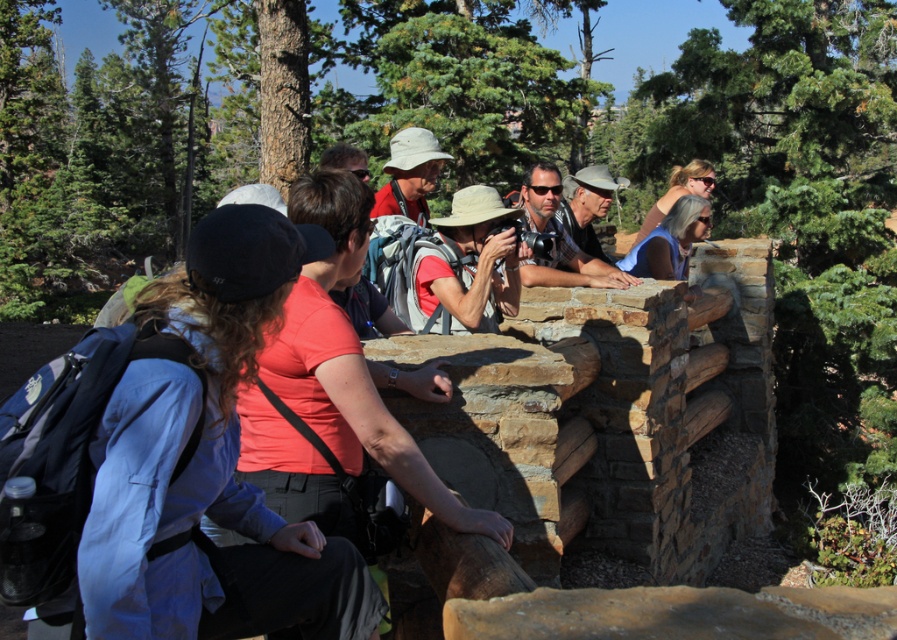
Is matte red shirt at center bigger than blonde hair at upper right?

Actually, matte red shirt at center might be smaller than blonde hair at upper right.

Measure the distance between matte red shirt at center and camera.

They are 3.86 meters apart.

Describe the element at coordinates (473, 262) in the screenshot. This screenshot has width=897, height=640. I see `matte red shirt at center` at that location.

The width and height of the screenshot is (897, 640). What are the coordinates of `matte red shirt at center` in the screenshot? It's located at pos(473,262).

From the picture: Is matte white hat at center wider than blonde hair at upper right?

In fact, matte white hat at center might be narrower than blonde hair at upper right.

Which of these two, matte white hat at center or blonde hair at upper right, stands shorter?

matte white hat at center

Which is behind, point (432, 147) or point (673, 188)?

The point (673, 188) is more distant.

Locate an element on the screen. matte white hat at center is located at coordinates (410, 173).

Is matte white hat at center positioned before matte blue shirt at upper right?

That is True.

Is point (427, 134) positioned before point (666, 257)?

Yes.

At what (x,y) coordinates should I click in order to perform the action: click on matte white hat at center. Please return your answer as a coordinate pair (x, y). The width and height of the screenshot is (897, 640). Looking at the image, I should click on (410, 173).